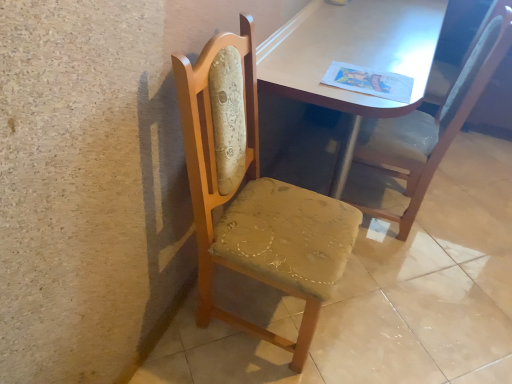
Find the location of a particular element. The image size is (512, 384). woodenchair at left, the 2th chair in the right-to-left sequence is located at coordinates (253, 194).

Measure the distance between point (225,349) and camera.

Point (225,349) and camera are 4.87 feet apart.

At what (x,y) coordinates should I click in order to perform the action: click on wooden chair at right, marked as the 2th chair in a left-to-right arrangement. Please return your answer as a coordinate pair (x, y). Looking at the image, I should click on (435, 120).

Does woodenchair at left, the 1th chair in the left-to-right sequence, have a greater width compared to wooden chair at center?

No, woodenchair at left, the 1th chair in the left-to-right sequence, is not wider than wooden chair at center.

Is woodenchair at left, the 2th chair in the right-to-left sequence, not near wooden chair at center?

No, woodenchair at left, the 2th chair in the right-to-left sequence, is not far away from wooden chair at center.

How much distance is there between woodenchair at left, the 1th chair in the left-to-right sequence, and wooden chair at center?

A distance of 21.70 inches exists between woodenchair at left, the 1th chair in the left-to-right sequence, and wooden chair at center.

Is woodenchair at left, the 2th chair in the right-to-left sequence, in front of or behind wooden chair at center in the image?

woodenchair at left, the 2th chair in the right-to-left sequence, is in front of wooden chair at center.

Does wooden chair at right, the 1th chair viewed from the right, turn towards woodenchair at left, the 2th chair in the right-to-left sequence?

No, wooden chair at right, the 1th chair viewed from the right, is not aimed at woodenchair at left, the 2th chair in the right-to-left sequence.

How different are the orientations of wooden chair at right, the 1th chair viewed from the right, and woodenchair at left, the 2th chair in the right-to-left sequence, in degrees?

Result: 174 degrees separate the facing orientations of wooden chair at right, the 1th chair viewed from the right, and woodenchair at left, the 2th chair in the right-to-left sequence.

Which is less distant, (465,98) or (295,226)?

Point (465,98) appears to be farther away from the viewer than point (295,226).

Considering the relative sizes of wooden chair at right, the 1th chair viewed from the right, and woodenchair at left, the 1th chair in the left-to-right sequence, in the image provided, is wooden chair at right, the 1th chair viewed from the right, bigger than woodenchair at left, the 1th chair in the left-to-right sequence,?

Correct, wooden chair at right, the 1th chair viewed from the right, is larger in size than woodenchair at left, the 1th chair in the left-to-right sequence.

From a real-world perspective, is matte wooden table at center on wooden chair at right, marked as the 2th chair in a left-to-right arrangement?

No.

Which is in front, matte wooden table at center or wooden chair at right, marked as the 2th chair in a left-to-right arrangement?

matte wooden table at center is in front.

Are matte wooden table at center and wooden chair at right, marked as the 2th chair in a left-to-right arrangement, located far from each other?

No, there isn't a large distance between matte wooden table at center and wooden chair at right, marked as the 2th chair in a left-to-right arrangement.

Which object is thinner, wooden chair at right, marked as the 2th chair in a left-to-right arrangement, or matte wooden table at center?

With smaller width is wooden chair at right, marked as the 2th chair in a left-to-right arrangement.

Based on the photo, from the image's perspective, which is below, wooden chair at right, marked as the 2th chair in a left-to-right arrangement, or matte wooden table at center?

From the image's view, wooden chair at right, marked as the 2th chair in a left-to-right arrangement, is below.

From a real-world perspective, who is located higher, wooden chair at right, marked as the 2th chair in a left-to-right arrangement, or matte wooden table at center?

wooden chair at right, marked as the 2th chair in a left-to-right arrangement, is physically above.

Is matte wooden table at center spatially inside wooden chair at center, or outside of it?

matte wooden table at center exists outside the volume of wooden chair at center.

From a real-world perspective, between matte wooden table at center and wooden chair at center, who is vertically lower?

wooden chair at center is physically lower.

Does matte wooden table at center have a smaller size compared to wooden chair at center?

No.

Is matte wooden table at center to the right of wooden chair at center from the viewer's perspective?

In fact, matte wooden table at center is to the left of wooden chair at center.

From the image's perspective, is wooden chair at right, marked as the 2th chair in a left-to-right arrangement, on top of wooden chair at center?

Yes, from the image's perspective, wooden chair at right, marked as the 2th chair in a left-to-right arrangement, is on top of wooden chair at center.

In the scene shown: How much distance is there between wooden chair at right, the 1th chair viewed from the right, and wooden chair at center?

A distance of 19.07 inches exists between wooden chair at right, the 1th chair viewed from the right, and wooden chair at center.

Between wooden chair at right, the 1th chair viewed from the right, and wooden chair at center, which one is positioned in front?

Positioned in front is wooden chair at center.

Can you confirm if wooden chair at center is shorter than woodenchair at left, the 1th chair in the left-to-right sequence?

Correct, wooden chair at center is not as tall as woodenchair at left, the 1th chair in the left-to-right sequence.

From the image's perspective, is wooden chair at center positioned above or below woodenchair at left, the 2th chair in the right-to-left sequence?

Clearly, from the image's perspective, wooden chair at center is below woodenchair at left, the 2th chair in the right-to-left sequence.

Consider the image. Is wooden chair at center facing towards woodenchair at left, the 1th chair in the left-to-right sequence?

No, wooden chair at center is not facing towards woodenchair at left, the 1th chair in the left-to-right sequence.

How much distance is there between wooden chair at center and woodenchair at left, the 2th chair in the right-to-left sequence?

wooden chair at center is 21.70 inches away from woodenchair at left, the 2th chair in the right-to-left sequence.

Starting from the wooden chair at center, which chair is the 2nd one to the left? Please provide its 2D coordinates.

[(253, 194)]

Where is `chair below the woodenchair at left, the 1th chair in the left-to-right sequence (from a real-world perspective)`? chair below the woodenchair at left, the 1th chair in the left-to-right sequence (from a real-world perspective) is located at coordinates (435, 120).

Considering their positions, is woodenchair at left, the 2th chair in the right-to-left sequence, positioned further to wooden chair at right, the 1th chair viewed from the right, than matte wooden table at center?

woodenchair at left, the 2th chair in the right-to-left sequence, lies further to wooden chair at right, the 1th chair viewed from the right, than the other object.

Considering their positions, is wooden chair at center positioned further to wooden chair at right, marked as the 2th chair in a left-to-right arrangement, than woodenchair at left, the 2th chair in the right-to-left sequence?

Among the two, woodenchair at left, the 2th chair in the right-to-left sequence, is located further to wooden chair at right, marked as the 2th chair in a left-to-right arrangement.

From the image, which object appears to be farther from matte wooden table at center, wooden chair at center or woodenchair at left, the 2th chair in the right-to-left sequence?

wooden chair at center lies further to matte wooden table at center than the other object.

Estimate the real-world distances between objects in this image. Which object is closer to matte wooden table at center, wooden chair at right, the 1th chair viewed from the right, or woodenchair at left, the 2th chair in the right-to-left sequence?

The object closer to matte wooden table at center is wooden chair at right, the 1th chair viewed from the right.

Which object lies nearer to the anchor point matte wooden table at center, wooden chair at right, the 1th chair viewed from the right, or wooden chair at center?

wooden chair at right, the 1th chair viewed from the right, is closer to matte wooden table at center.

Based on their spatial positions, is matte wooden table at center or wooden chair at center closer to woodenchair at left, the 1th chair in the left-to-right sequence?

matte wooden table at center lies closer to woodenchair at left, the 1th chair in the left-to-right sequence, than the other object.

Estimate the real-world distances between objects in this image. Which object is further from wooden chair at right, the 1th chair viewed from the right, wooden chair at center or matte wooden table at center?

The object further to wooden chair at right, the 1th chair viewed from the right, is wooden chair at center.

From the image, which object appears to be nearer to woodenchair at left, the 1th chair in the left-to-right sequence, wooden chair at center or matte wooden table at center?

Among the two, matte wooden table at center is located nearer to woodenchair at left, the 1th chair in the left-to-right sequence.

This screenshot has width=512, height=384. I want to click on chair between woodenchair at left, the 1th chair in the left-to-right sequence, and wooden chair at center, in the horizontal direction, so click(435, 120).

Find the location of a particular element. This screenshot has width=512, height=384. table positioned between woodenchair at left, the 2th chair in the right-to-left sequence, and wooden chair at right, the 1th chair viewed from the right, from near to far is located at coordinates (351, 58).